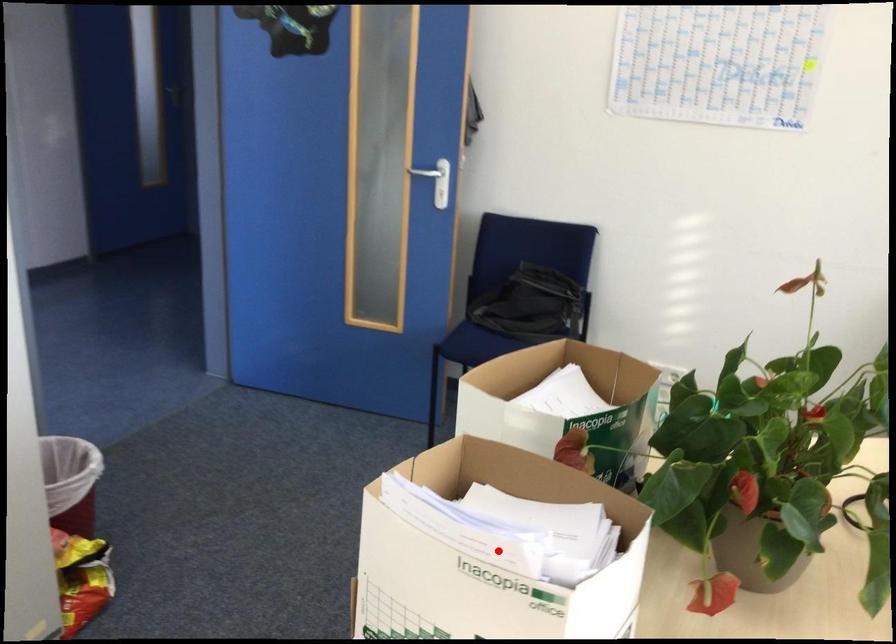
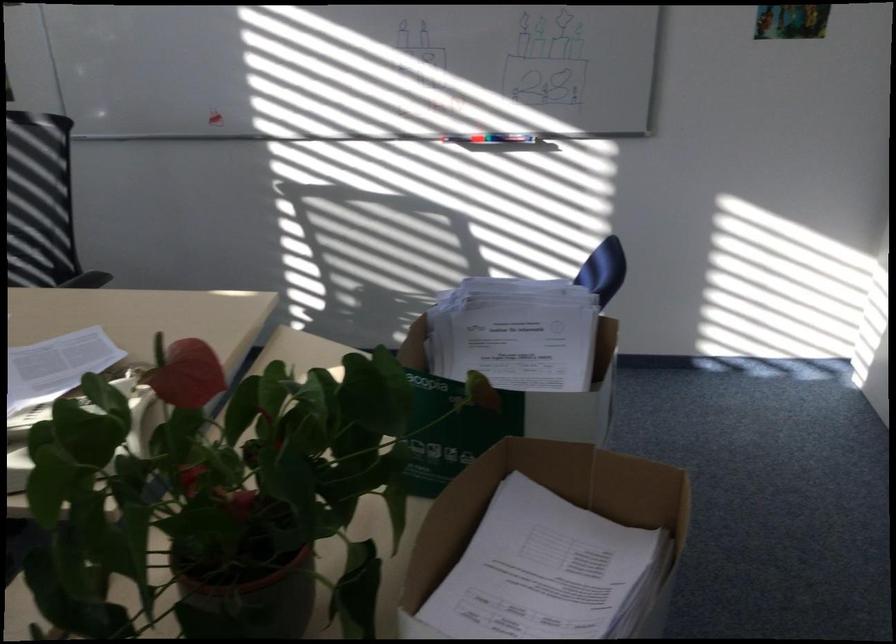
Question: I am providing you with two images of the same scene from different viewpoints. Given a red point in image1, look at the same physical point in image2. Is it:

Choices:
 (A) Closer to the viewpoint
 (B) Farther from the viewpoint

Answer: (B)